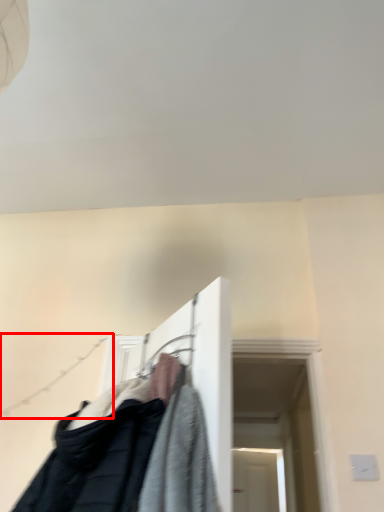
Question: From the image's perspective, where is clothesline (annotated by the red box) located in relation to closet in the image?

Choices:
 (A) above
 (B) below

Answer: (B)